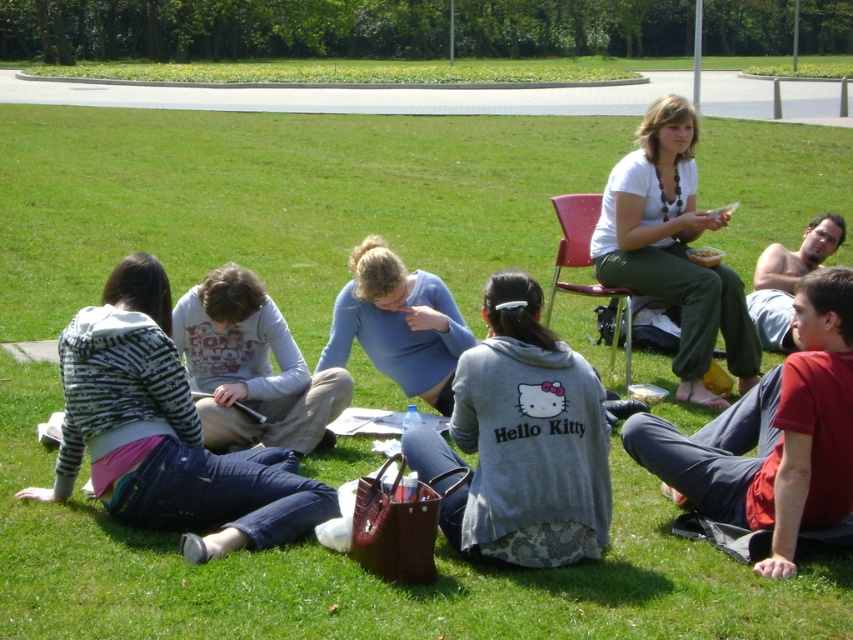
You are a photographer trying to capture a clear shot of both the white matte shirt at upper right and the white cotton shirt at center. Since you want both shirts to be visible in the photo, which shirt should you adjust your camera focus to prioritize?

You should prioritize focusing on the white matte shirt at upper right because the white cotton shirt at center is behind it, so adjusting focus to the front shirt will ensure both are in the frame.

You are standing at the center of the grassy area and want to hand a document to the person wearing the red cotton shirt at lower right. However, the plastic pink chair at upper right is blocking your path. Is there a way to reach the person without moving the chair?

The red cotton shirt at lower right is in front of the plastic pink chair at upper right, so you can reach the person without moving the chair because the shirt is already in front of the chair.